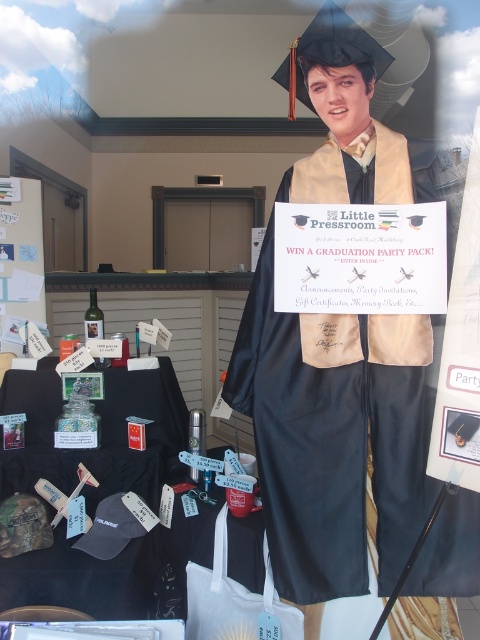
Question: Which point appears closest to the camera in this image?

Choices:
 (A) (251, 346)
 (B) (151, 480)

Answer: (A)

Question: Is gold satin graduation gown at center above black fabric table at lower left?

Choices:
 (A) no
 (B) yes

Answer: (B)

Question: Which of the following is the farthest from the observer?

Choices:
 (A) (103, 440)
 (B) (323, 589)

Answer: (A)

Question: Is gold satin graduation gown at center below black fabric table at lower left?

Choices:
 (A) yes
 (B) no

Answer: (B)

Question: Is gold satin graduation gown at center closer to camera compared to black fabric table at lower left?

Choices:
 (A) no
 (B) yes

Answer: (B)